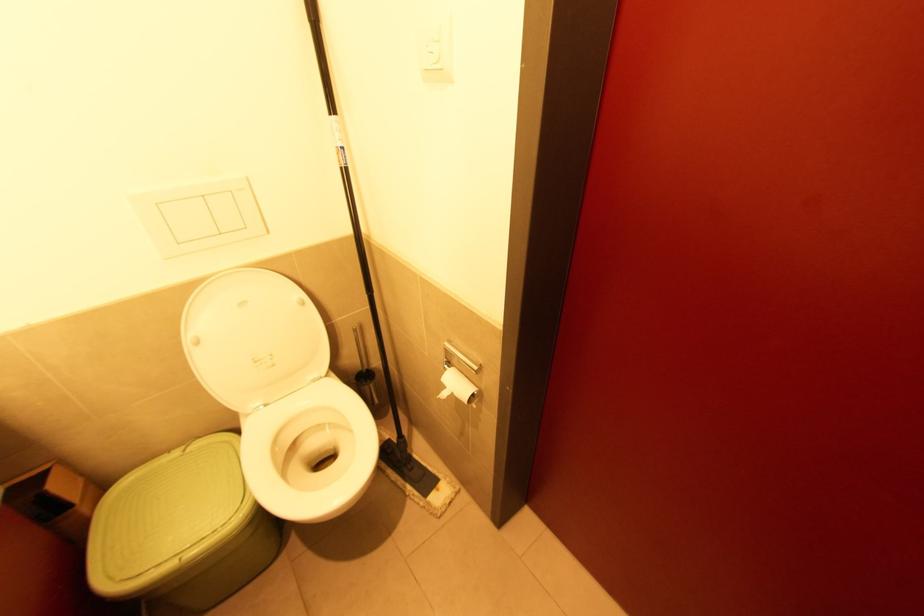
Locate an element on the screen. The height and width of the screenshot is (616, 924). white toilet lid is located at coordinates (252, 338).